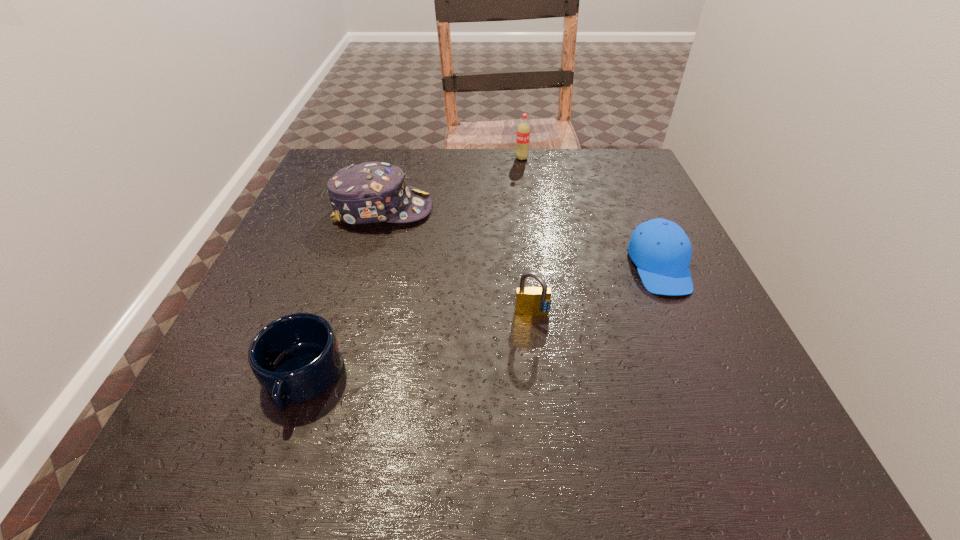
Find the location of a particular element. free space located 0.120m on the front-facing side of the right cap is located at coordinates (698, 353).

Image resolution: width=960 pixels, height=540 pixels. I want to click on vacant space situated with the handle on the side of the nearest object, so click(x=269, y=474).

Where is `soda located at the far edge`? soda located at the far edge is located at coordinates (523, 130).

Identify the location of headwear located at the far edge. The width and height of the screenshot is (960, 540). (370, 192).

I want to click on object at the near edge, so click(x=295, y=358).

At what (x,y) coordinates should I click in order to perform the action: click on headwear that is at the left edge. Please return your answer as a coordinate pair (x, y). The image size is (960, 540). Looking at the image, I should click on (370, 192).

The width and height of the screenshot is (960, 540). I want to click on mug that is at the left edge, so click(x=295, y=358).

Where is `object that is at the right edge`? object that is at the right edge is located at coordinates (661, 250).

I want to click on object at the far left corner, so tap(370, 192).

Where is `object at the near left corner`? object at the near left corner is located at coordinates (295, 358).